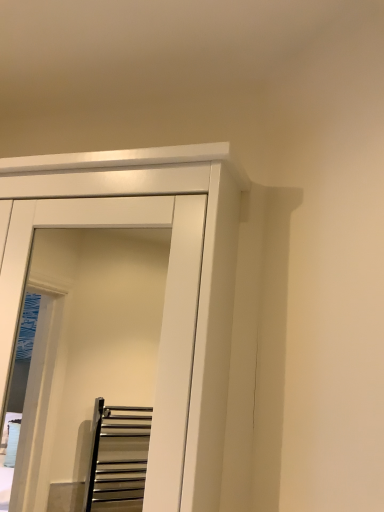
In order to click on white glossy door at upper center in this screenshot , I will do `click(163, 311)`.

This screenshot has width=384, height=512. What do you see at coordinates (163, 311) in the screenshot?
I see `white glossy door at upper center` at bounding box center [163, 311].

Locate an element on the screen. The image size is (384, 512). white glossy door at upper center is located at coordinates pyautogui.click(x=163, y=311).